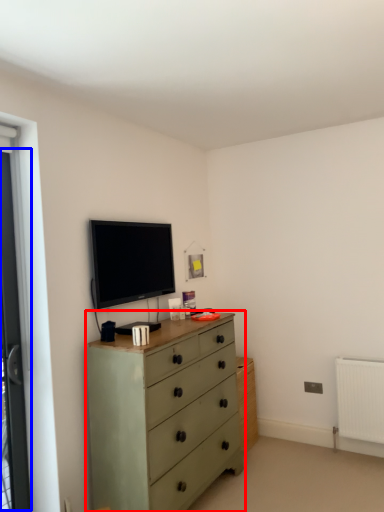
Question: Which point is further to the camera, chest of drawers (highlighted by a red box) or screen door (highlighted by a blue box)?

Choices:
 (A) chest of drawers
 (B) screen door

Answer: (B)